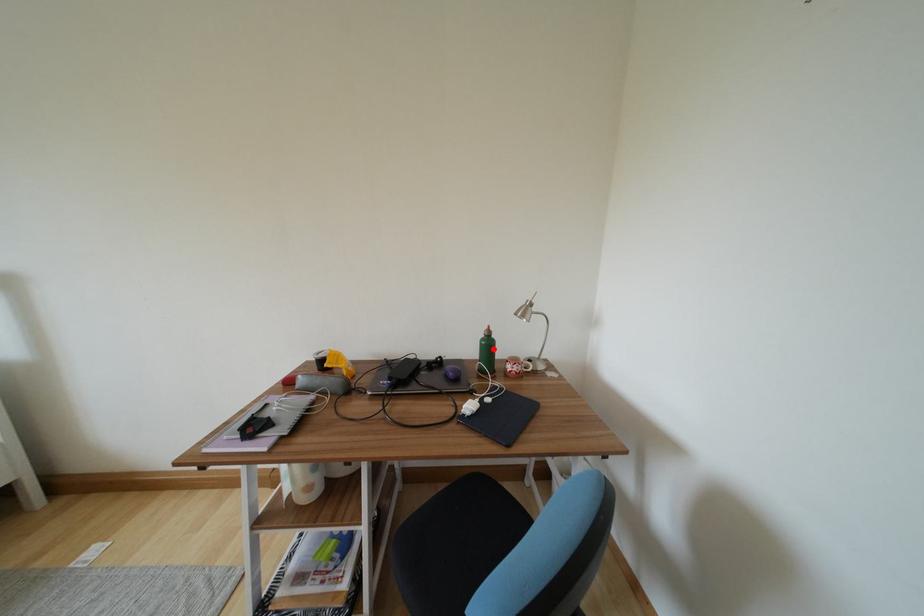
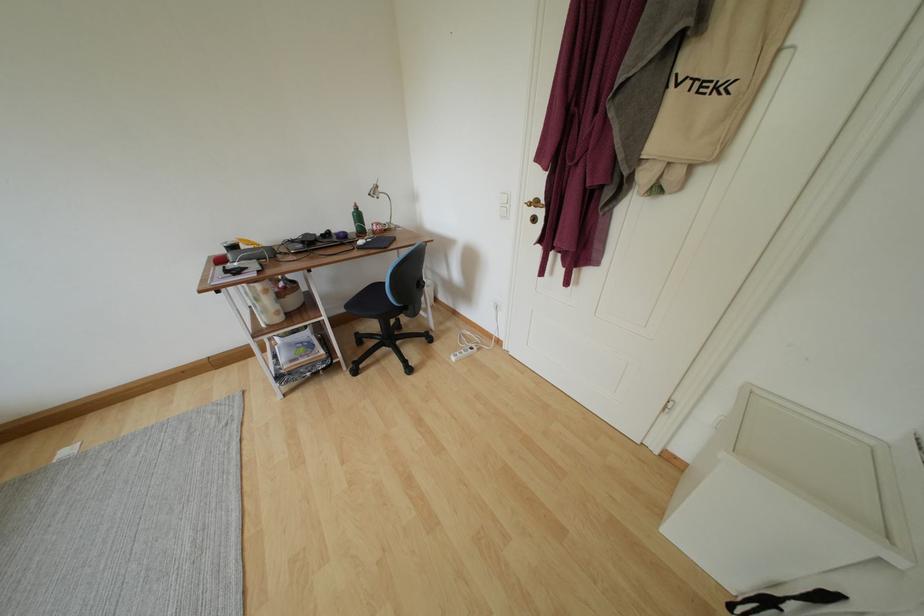
Question: I am providing you with two images of the same scene from different viewpoints. A red point is marked on the first image. At the location where the point appears in image 1, is it still visible in image 2?

Choices:
 (A) Yes
 (B) No

Answer: (A)